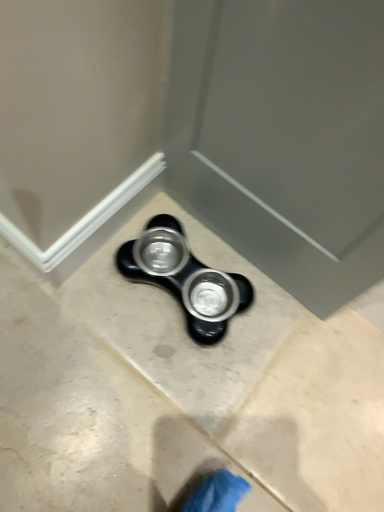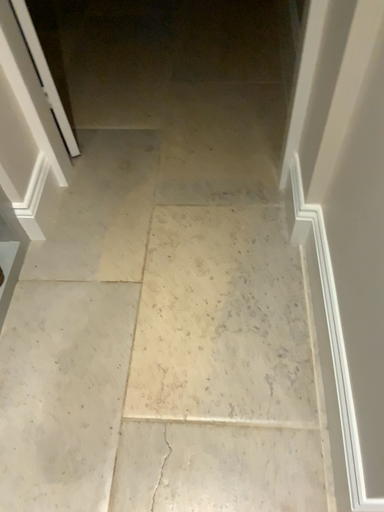
Question: How did the camera likely rotate when shooting the video?

Choices:
 (A) rotated upward
 (B) rotated downward

Answer: (A)